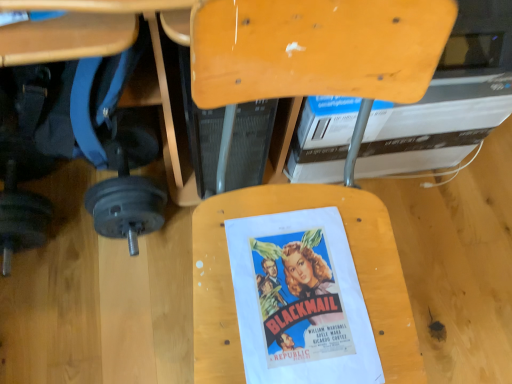
Locate an element on the screen. free space in front of white cardboard book at upper center is located at coordinates (431, 257).